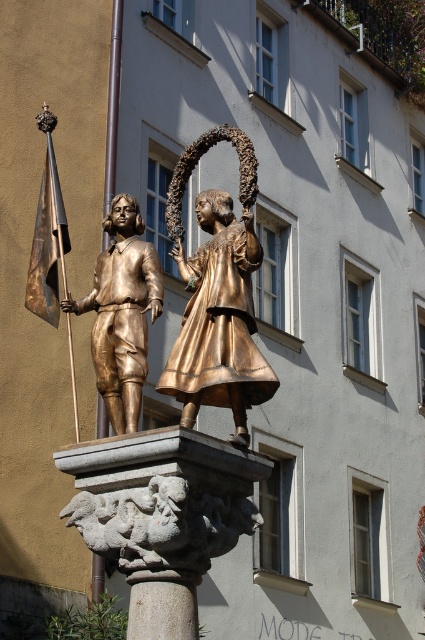
You are standing in front of the statue and want to take a photo. You notice two points on the statue labeled as point 1 at coordinate point (116,392) and point 2 at coordinate point (153,624). If you want to focus on the part of the statue that is closer to you, which point should you aim your camera at?

Point (153,624) is closer to you than point (116,392), so you should aim your camera at point (153,624) to focus on the part closer to you.